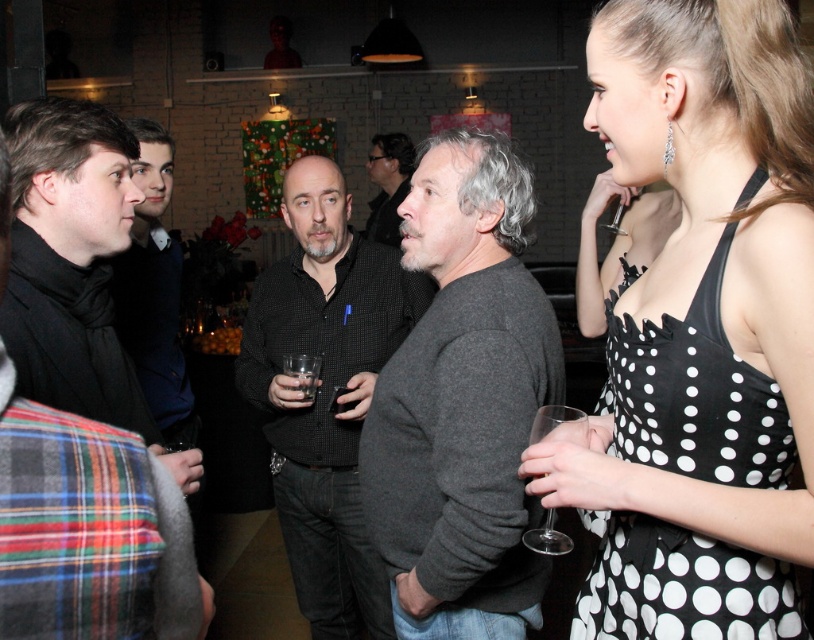
Question: Which of the following is the farthest from the observer?

Choices:
 (A) dark blue shirt at left
 (B) transparent glass at center
 (C) black textured shirt at center

Answer: (A)

Question: Is dark gray sweater at center wider than black wool scarf at left?

Choices:
 (A) no
 (B) yes

Answer: (A)

Question: Considering the relative positions of black textured shirt at center and black wool scarf at left in the image provided, where is black textured shirt at center located with respect to black wool scarf at left?

Choices:
 (A) right
 (B) left

Answer: (A)

Question: Considering the real-world distances, which object is closest to the dark gray sweater at center?

Choices:
 (A) transparent glass at center
 (B) black polka dot dress at center
 (C) dark blue shirt at left

Answer: (A)

Question: Is black textured shirt at center closer to camera compared to transparent glass at center?

Choices:
 (A) yes
 (B) no

Answer: (A)

Question: Estimate the real-world distances between objects in this image. Which object is farther from the black wool scarf at left?

Choices:
 (A) clear glass wine glass at lower right
 (B) black dotted dress at center
 (C) black textured shirt at center

Answer: (B)